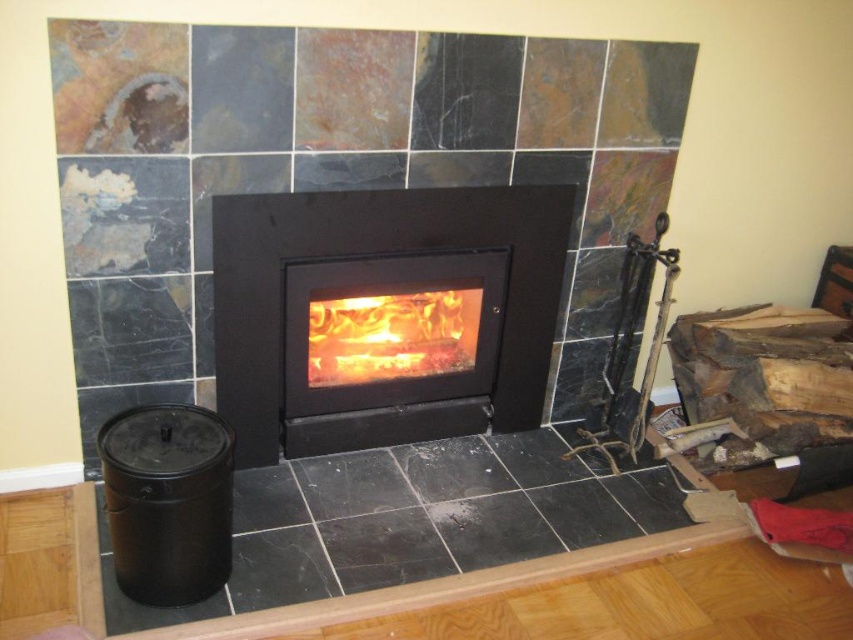
You are designing a living room and want to place a sofa in front of the black matte fireplace at center and the flamewoodfireplace at center. Which fireplace should the sofa be closer to if you want it to be proportionally balanced with the size of the fireplaces?

The sofa should be closer to the flamewoodfireplace at center because the black matte fireplace at center is larger in size, so placing the sofa closer to the smaller flamewoodfireplace at center would create a balanced proportion between the two fireplaces.

From the picture: You are sitting on a couch facing the fireplace. You want to place a decorative plaque on the wall behind the black matte fireplace at center. Is the flamewoodfireplace at center in the way?

The black matte fireplace at center is in front of the flamewoodfireplace at center, so placing the plaque behind the black matte fireplace at center would not be obstructed by the flamewoodfireplace at center since it is positioned behind.